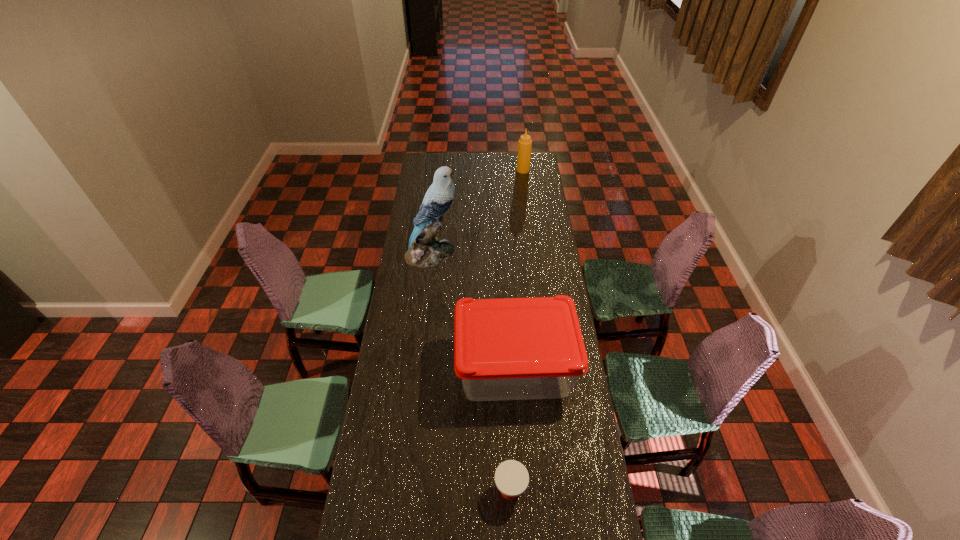
The image size is (960, 540). What are the coordinates of `the tallest object` in the screenshot? It's located at (424, 249).

The width and height of the screenshot is (960, 540). I want to click on parakeet, so click(424, 249).

Image resolution: width=960 pixels, height=540 pixels. I want to click on condiment, so click(525, 143).

This screenshot has width=960, height=540. What are the coordinates of `the second nearest object` in the screenshot? It's located at (513, 348).

This screenshot has height=540, width=960. I want to click on the shortest object, so click(x=511, y=477).

In order to click on Dixie cup in this screenshot , I will do `click(511, 477)`.

What are the coordinates of `vacant position located 0.320m on the face of the tallest object` in the screenshot? It's located at (521, 253).

You are a GUI agent. You are given a task and a screenshot of the screen. Output one action in this format:
    pyautogui.click(x=<x>, y=<y>)
    Task: Click on the free space located 0.260m on the left of the condiment
    This screenshot has height=540, width=960.
    Given the screenshot: What is the action you would take?
    pyautogui.click(x=474, y=170)

Locate an element on the screen. The height and width of the screenshot is (540, 960). blank area located 0.090m on the left of the third farthest object is located at coordinates (433, 368).

Where is `free spot located on the back of the nearest object`? free spot located on the back of the nearest object is located at coordinates (509, 449).